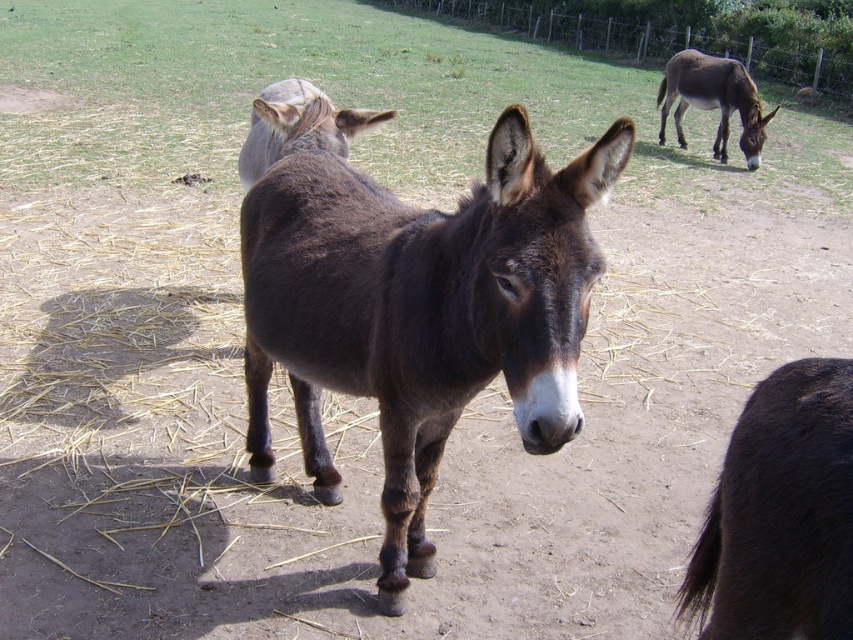
Based on the scene description, which object is wider, the dark brown fur at center or the brown matte donkey at upper center?

The dark brown fur at center is wider than the brown matte donkey at upper center according to the description.

You are a farmer trying to locate your donkey. You remember that your donkey has dark brown fur at center. Based on the image, where would you find it?

The dark brown fur at center is located at point (415, 300), so the donkey is at that position.

You are standing in a pasture and see the dark brown fur at lower right and the brown matte donkey at upper center. Which one is closer to the ground?

The dark brown fur at lower right is located below the brown matte donkey at upper center, so it is closer to the ground.